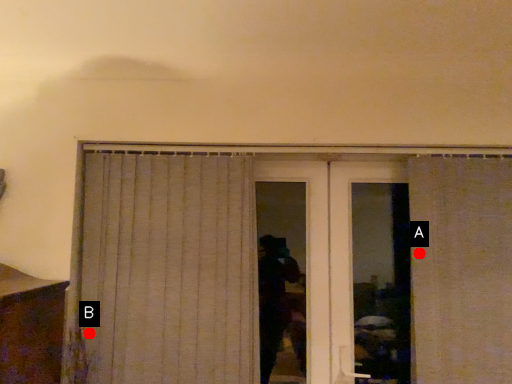
Question: Two points are circled on the image, labeled by A and B beside each circle. Among these points, which one is nearest to the camera?

Choices:
 (A) A is closer
 (B) B is closer

Answer: (B)